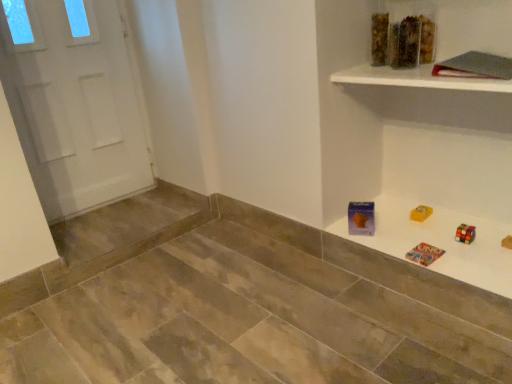
Question: Is translucent plastic container at upper right, positioned as the 2th toy in right-to-left order, to the left or to the right of translucent plastic container at upper right, which is the first toy in right-to-left order, in the image?

Choices:
 (A) right
 (B) left

Answer: (B)

Question: From the image's perspective, is translucent plastic container at upper right, positioned as the 2th toy in right-to-left order, located above or below translucent plastic container at upper right, the 2th toy when ordered from left to right?

Choices:
 (A) above
 (B) below

Answer: (B)

Question: Considering the real-world distances, which object is farthest from the white glossy door at left?

Choices:
 (A) translucent plastic container at upper right, the 2th toy when ordered from left to right
 (B) multicolored plastic puzzle at upper right
 (C) translucent plastic container at upper center
 (D) white glossy shelf at upper right
 (E) translucent plastic container at upper right, which appears as the 1th toy when viewed from the left

Answer: (E)

Question: Which is nearer to the multicolored plastic puzzle at upper right?

Choices:
 (A) translucent plastic container at upper center
 (B) translucent plastic container at upper right, positioned as the 2th toy in right-to-left order
 (C) white glossy shelf at upper right
 (D) white glossy door at left
 (E) translucent plastic container at upper right, the 2th toy when ordered from left to right

Answer: (C)